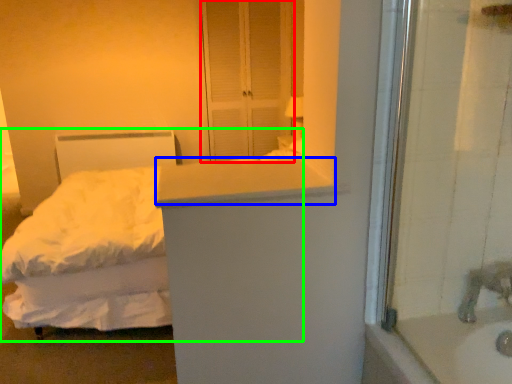
Question: Which object is the closest to the screen door (highlighted by a red box)? Choose among these: counter top (highlighted by a blue box) or bed (highlighted by a green box).

Choices:
 (A) counter top
 (B) bed

Answer: (B)